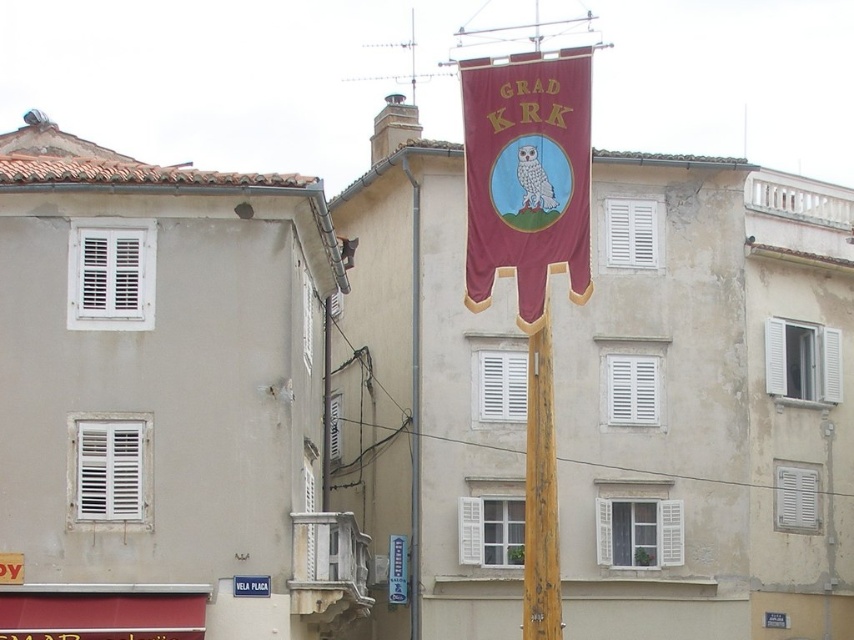
You are standing in front of the wooden pole at center and the maroon fabric banner at center in the European town. Which object is closer to you?

The maroon fabric banner at center is closer to you because the wooden pole at center is behind it.

You are standing in the European town and see the maroon fabric banner at center and the wooden pole at center. Which object is positioned to the right of the other?

The maroon fabric banner at center is to the right of wooden pole at center.

You are standing in front of the wooden pole with the red banner. There is a point marked at coordinates (527, 176). What is the location of this point relative to the maroon fabric banner at center?

The point at (527, 176) is located on the maroon fabric banner at center.